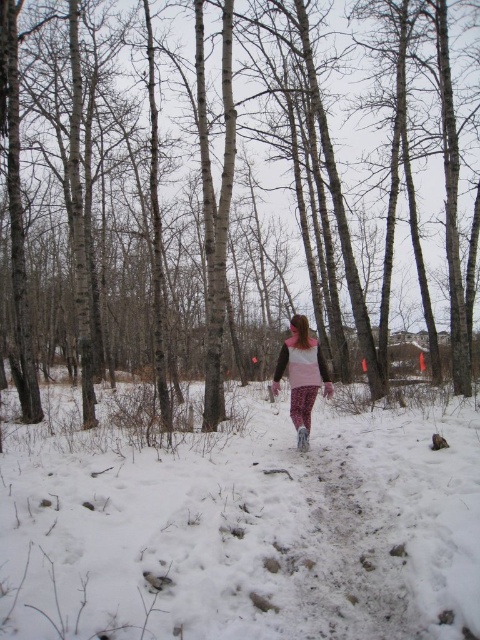
You are a photographer trying to capture the brown smooth tree at center and the pink fleece jacket at center in a single frame. Based on their positions, which object should appear higher in your photo?

The brown smooth tree at center appears higher in the photo because it is positioned above the pink fleece jacket at center.

Looking at this image, you are a photographer trying to capture the person in the pink fleece jacket at center. The white powdery snow at center is in the way. Can you tell me if the snow is taller than the jacket so I know if I need to adjust my camera angle upwards or downwards?

The white powdery snow at center is not as tall as the pink fleece jacket at center, so you should adjust your camera angle downwards to capture the jacket without obstruction.